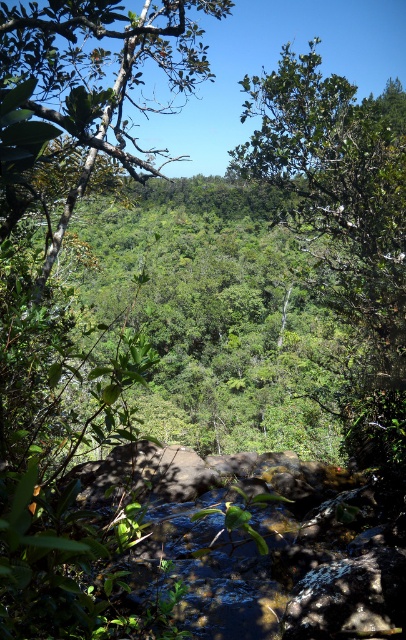
You are a hiker navigating through the forest and want to reach a point that is closer to you. Which point should you head towards, point [388,282] or point [149,35]?

You should head towards point [149,35] because it is closer to you than point [388,282].

You are a hiker trying to navigate through the forest. You see a green leafy tree at center and a green leafy tree at upper left. Which tree is closer to the left edge of the forest path?

The green leafy tree at upper left is closer to the left edge of the forest path because it is positioned to the left of the green leafy tree at center.

You are a hiker trying to navigate through the forest. You see a green leafy tree at center and a green leafy tree at upper left. Which tree would appear closer to you as you look at the forest scene?

The green leafy tree at center is closer to you because it is positioned further to the viewer than the green leafy tree at upper left, making it appear nearer in the scene.